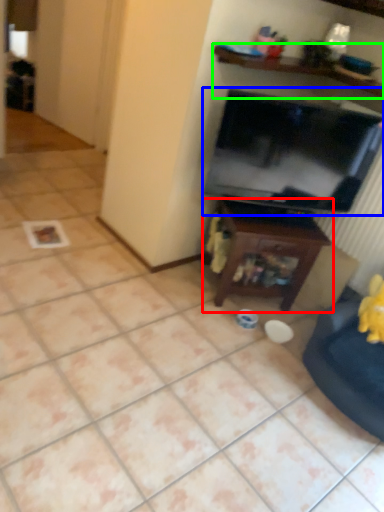
Question: Which is nearer to the table (highlighted by a red box)? television (highlighted by a blue box) or shelf (highlighted by a green box).

Choices:
 (A) television
 (B) shelf

Answer: (A)